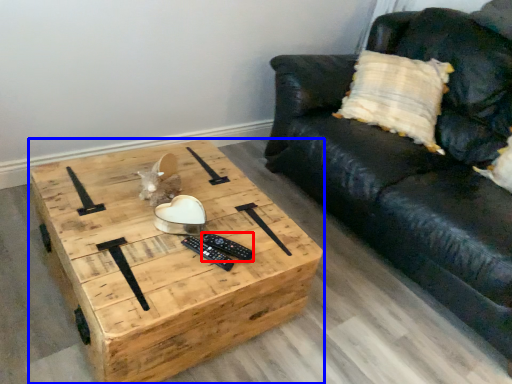
Question: Which of the following is the closest to the observer, remote (highlighted by a red box) or coffee table (highlighted by a blue box)?

Choices:
 (A) remote
 (B) coffee table

Answer: (B)